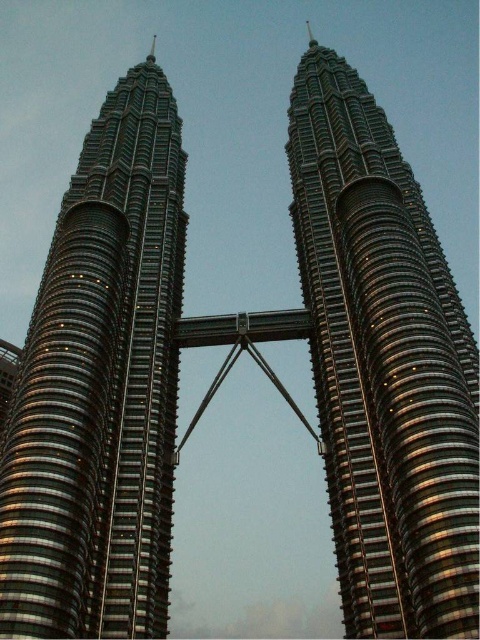
Question: Which object appears farthest from the camera in this image?

Choices:
 (A) shiny metallic skyscraper at left
 (B) shiny metallic tower at center

Answer: (A)

Question: Which of the following is the farthest from the observer?

Choices:
 (A) shiny metallic skyscraper at left
 (B) shiny metallic tower at center

Answer: (A)

Question: Does shiny metallic skyscraper at left appear under shiny metallic tower at center?

Choices:
 (A) yes
 (B) no

Answer: (A)

Question: Which point appears closest to the camera in this image?

Choices:
 (A) pyautogui.click(x=372, y=417)
 (B) pyautogui.click(x=99, y=113)

Answer: (A)

Question: Is shiny metallic skyscraper at left thinner than shiny metallic tower at center?

Choices:
 (A) yes
 (B) no

Answer: (B)

Question: Can you confirm if shiny metallic skyscraper at left is positioned to the right of shiny metallic tower at center?

Choices:
 (A) yes
 (B) no

Answer: (B)